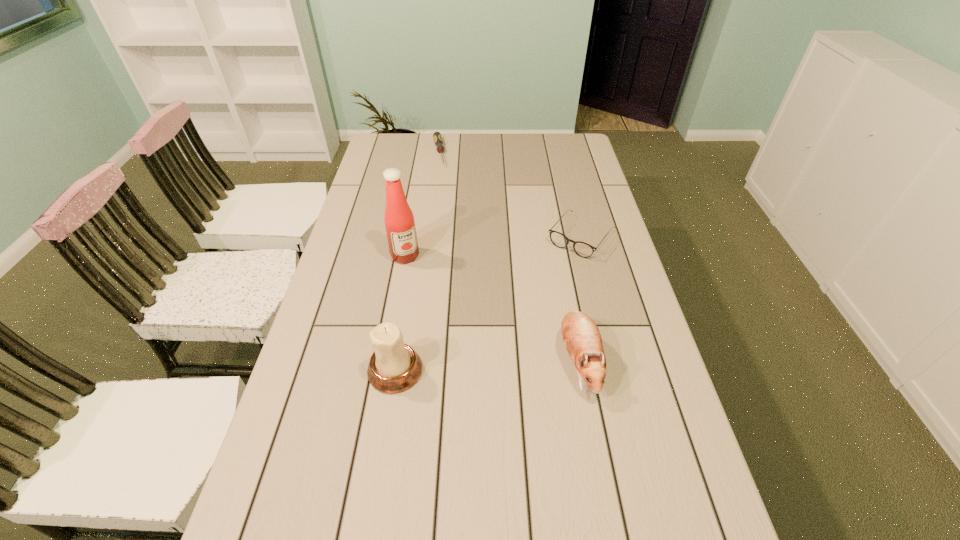
Where is `vacant space on the desktop that is between the candle holder and the hamster and is positioned on the front-facing side of the tallest object`? The image size is (960, 540). vacant space on the desktop that is between the candle holder and the hamster and is positioned on the front-facing side of the tallest object is located at coordinates (463, 367).

Locate an element on the screen. The image size is (960, 540). free space on the desktop that is between the candle holder and the hamster and is positioned through the lenses of the spectacles is located at coordinates (476, 366).

In order to click on vacant spot on the desktop that is between the fourth shortest object and the third shortest object and is positioned insert the shortest object into a screw head in this screenshot , I will do `click(491, 365)`.